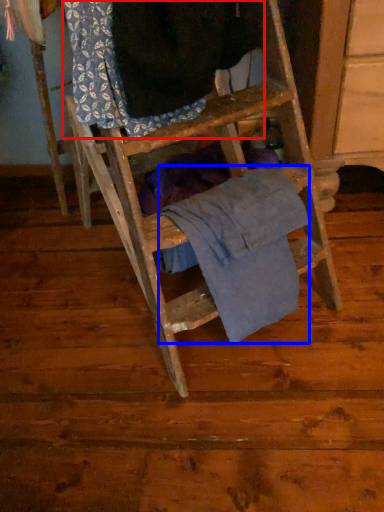
Question: Which object appears closest to the camera in this image, clothing (highlighted by a red box) or clothing (highlighted by a blue box)?

Choices:
 (A) clothing
 (B) clothing

Answer: (A)